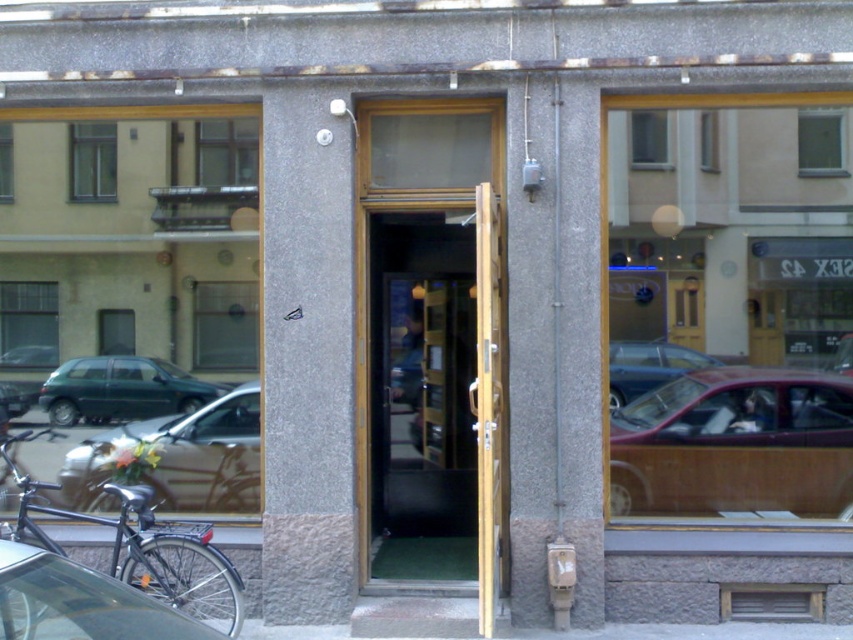
From the picture: Who is higher up, metallic silver car at left or metallic silver car at lower left?

Positioned higher is metallic silver car at lower left.

Who is more forward, (x=229, y=456) or (x=102, y=572)?

Point (x=102, y=572)

Does point (196, 499) lie behind point (82, 566)?

Yes, it is.

This screenshot has height=640, width=853. Find the location of `metallic silver car at left`. metallic silver car at left is located at coordinates (178, 458).

Can you confirm if metallic silver car at left is shorter than metallic red car at center?

No, metallic silver car at left is not shorter than metallic red car at center.

Who is more forward, (218, 493) or (619, 392)?

Point (619, 392)

The width and height of the screenshot is (853, 640). In order to click on metallic silver car at left in this screenshot , I will do `click(178, 458)`.

Does wooden panel car at center come behind green matte car at left?

No, it is not.

Can you confirm if wooden panel car at center is wider than green matte car at left?

Indeed, wooden panel car at center has a greater width compared to green matte car at left.

Between point (724, 410) and point (55, 422), which one is positioned behind?

Point (55, 422)

You are a GUI agent. You are given a task and a screenshot of the screen. Output one action in this format:
    pyautogui.click(x=<x>, y=<y>)
    Task: Click on the wooden panel car at center
    The image size is (853, 640).
    Given the screenshot: What is the action you would take?
    pyautogui.click(x=735, y=445)